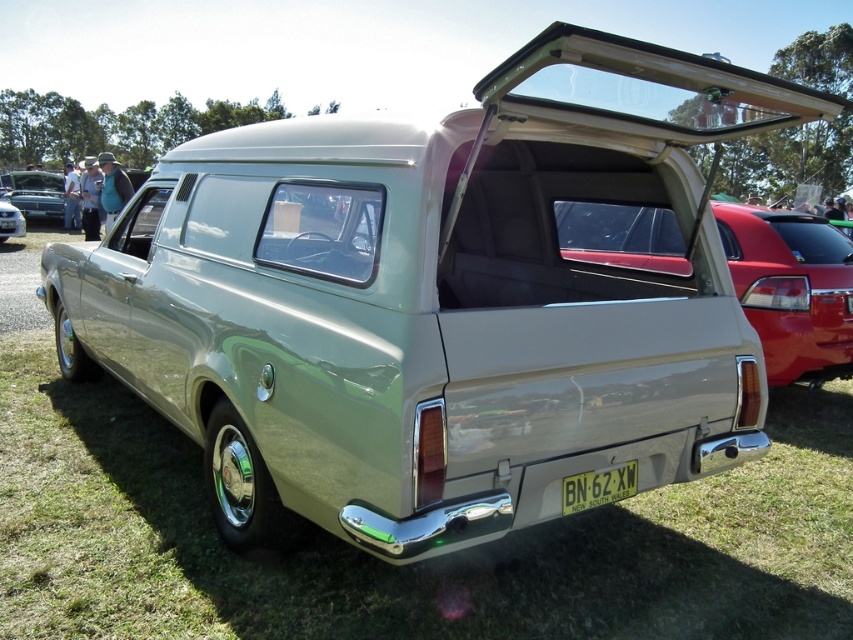
Between white plastic license plate at center and satin silver panel van at center, which one appears on the left side from the viewer's perspective?

satin silver panel van at center is more to the left.

Does white plastic license plate at center appear over satin silver panel van at center?

Incorrect, white plastic license plate at center is not positioned above satin silver panel van at center.

Describe the element at coordinates (598, 486) in the screenshot. The image size is (853, 640). I see `white plastic license plate at center` at that location.

The image size is (853, 640). In order to click on white plastic license plate at center in this screenshot , I will do `click(598, 486)`.

Measure the distance between point (762, 544) and camera.

Point (762, 544) is 3.40 meters away from camera.

Is green glossy car at center below shiny black car at left?

Yes.

Which is in front, point (434, 620) or point (49, 176)?

Point (434, 620) is in front.

Find the location of `green glossy car at center`. green glossy car at center is located at coordinates (405, 564).

Does satin silver panel at center lie behind shiny black car at left?

No.

Does satin silver panel at center have a greater width compared to shiny black car at left?

In fact, satin silver panel at center might be narrower than shiny black car at left.

Who is more forward, (677, 244) or (39, 172)?

Positioned in front is point (677, 244).

Where is `satin silver panel at center`? satin silver panel at center is located at coordinates (791, 289).